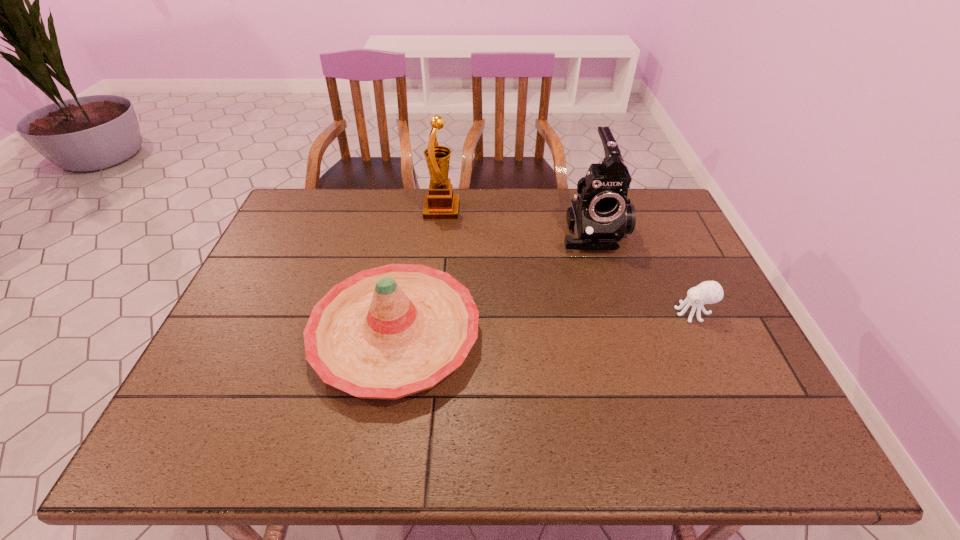
Image resolution: width=960 pixels, height=540 pixels. Find the location of `free space located 0.260m on the front-facing side of the shortest object`. free space located 0.260m on the front-facing side of the shortest object is located at coordinates (575, 313).

You are a GUI agent. You are given a task and a screenshot of the screen. Output one action in this format:
    pyautogui.click(x=<x>, y=<y>)
    Task: Click on the award positioned at the far edge
    The width and height of the screenshot is (960, 540).
    Given the screenshot: What is the action you would take?
    pyautogui.click(x=440, y=203)

Where is `camcorder present at the far edge`? camcorder present at the far edge is located at coordinates (599, 216).

Where is `object that is at the right edge`? The height and width of the screenshot is (540, 960). object that is at the right edge is located at coordinates (708, 292).

Where is `free location at the far edge of the desktop`? The width and height of the screenshot is (960, 540). free location at the far edge of the desktop is located at coordinates (420, 204).

In the image, there is a desktop. Where is `vacant space at the near edge`? This screenshot has height=540, width=960. vacant space at the near edge is located at coordinates (355, 428).

This screenshot has height=540, width=960. In the image, there is a desktop. Identify the location of free space at the left edge. (217, 357).

Locate an element on the screen. This screenshot has height=540, width=960. free spot at the right edge of the desktop is located at coordinates (709, 393).

Locate an element on the screen. The image size is (960, 540). vacant space at the far right corner is located at coordinates (643, 211).

Where is `vacant space in between the camcorder and the award`? vacant space in between the camcorder and the award is located at coordinates (517, 220).